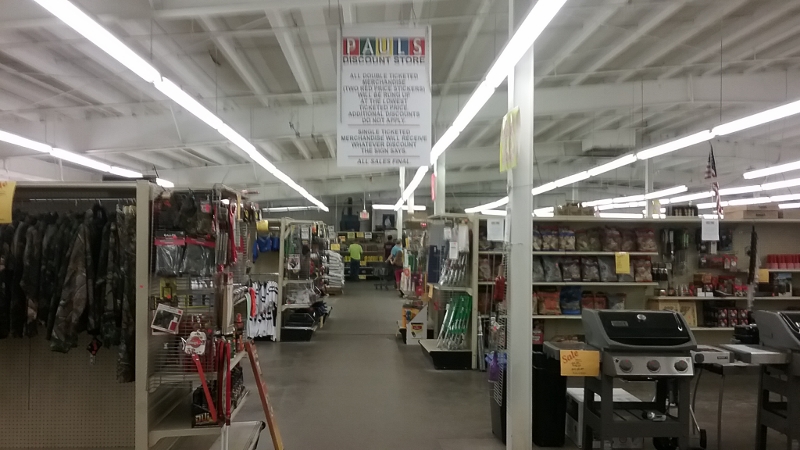
Image resolution: width=800 pixels, height=450 pixels. I want to click on flooring, so click(x=400, y=428), click(x=309, y=381), click(x=357, y=318), click(x=429, y=397).